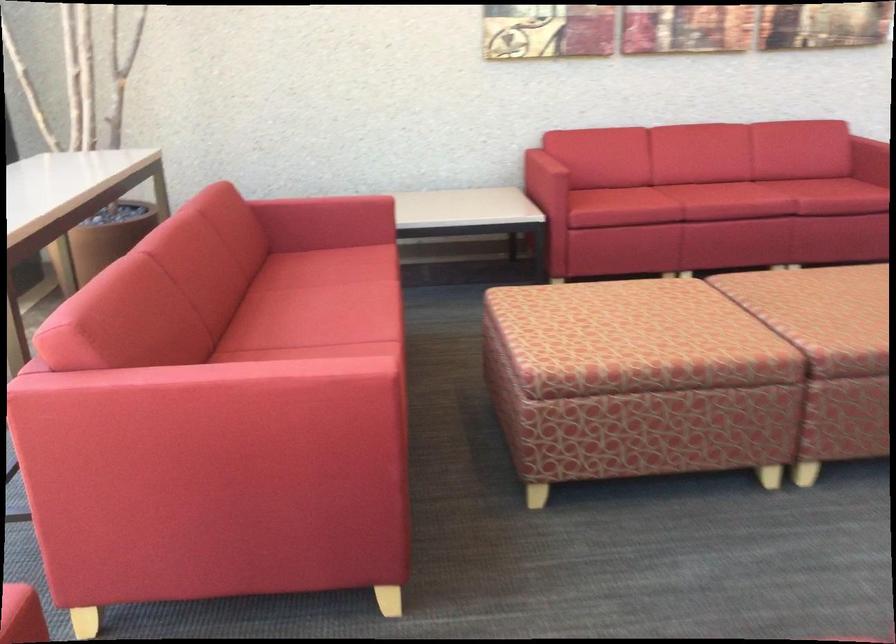
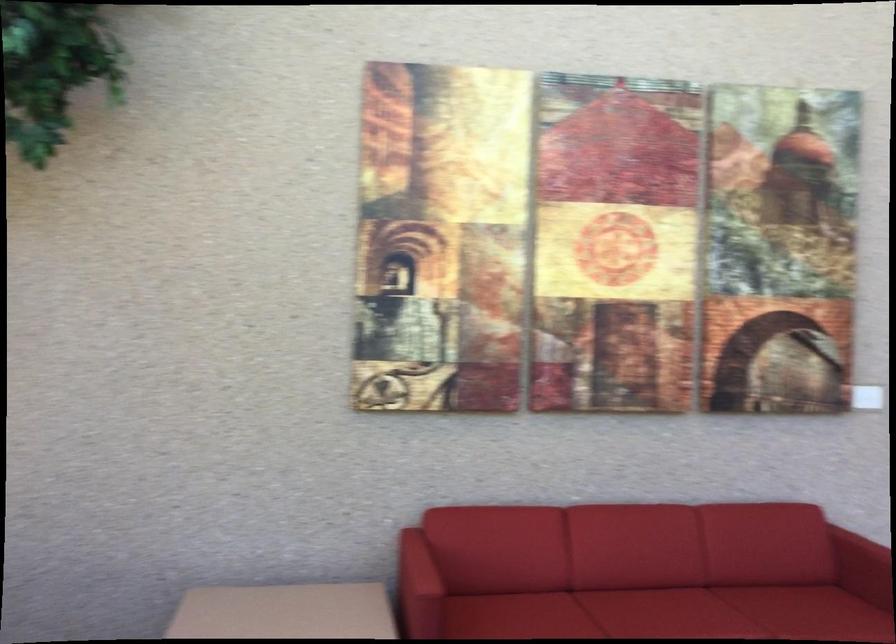
Locate, in the second image, the point that corresponds to (709,183) in the first image.

(659, 607)